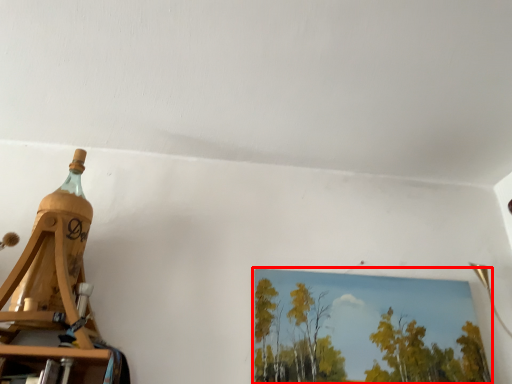
Question: From the image's perspective, considering the relative positions of picture frame (annotated by the red box) and bottle in the image provided, where is picture frame (annotated by the red box) located with respect to the staircase?

Choices:
 (A) below
 (B) above

Answer: (A)